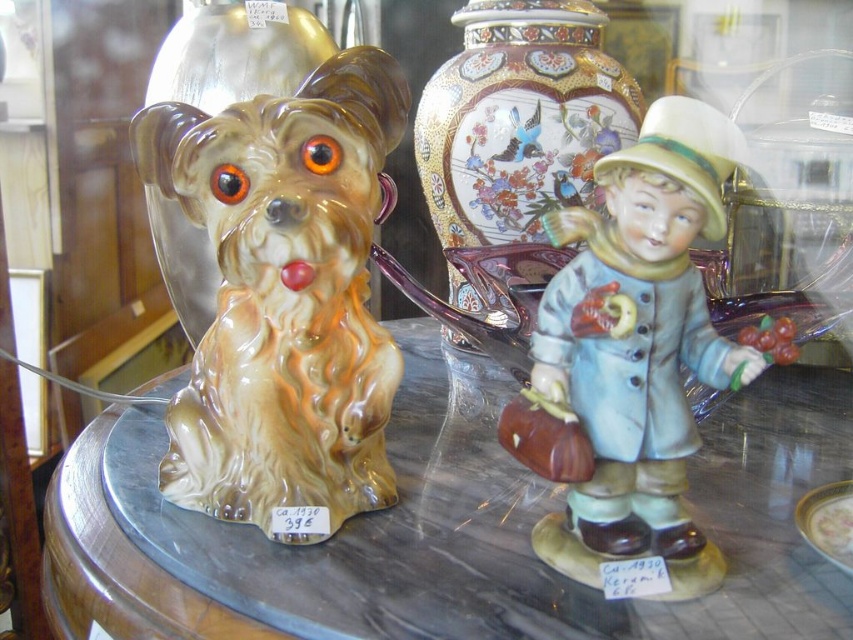
Does point (282, 429) come closer to viewer compared to point (260, 35)?

Yes.

Is matte ceramic dog at left closer to the viewer compared to shiny gold vase at left?

Yes, matte ceramic dog at left is closer to the viewer.

What are the coordinates of `matte ceramic dog at left` in the screenshot? It's located at (283, 298).

Can you confirm if porcelain vase with floral design at center is bigger than shiny gold vase at left?

Yes.

Find the location of a particular element. porcelain vase with floral design at center is located at coordinates (519, 120).

Who is taller, porcelain boy figurine at center or shiny gold vase at left?

Standing taller between the two is shiny gold vase at left.

Can you confirm if porcelain boy figurine at center is thinner than shiny gold vase at left?

Yes, porcelain boy figurine at center is thinner than shiny gold vase at left.

Where is `porcelain boy figurine at center`? This screenshot has height=640, width=853. porcelain boy figurine at center is located at coordinates (631, 353).